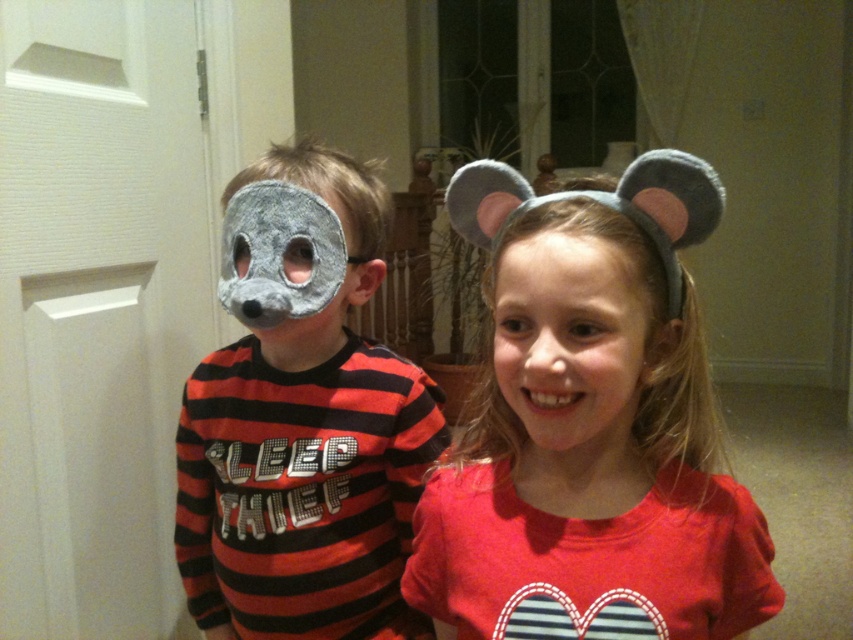
You are a photographer setting up for a family portrait. You notice the matte gray headband with ears at center and the smooth skin face at center in the scene. Which object would block more of the background when positioned closer to the camera?

The matte gray headband with ears at center is bigger than the smooth skin face at center, so it would block more of the background when positioned closer to the camera.

You are standing in the room and want to move from the point at coordinates point [332,532] to the point at coordinates point [577,246]. According to the image, can you walk directly between these two points without any obstacles?

Point [332,532] is behind point [577,246], so you cannot walk directly between them without moving around the obstacle in front.